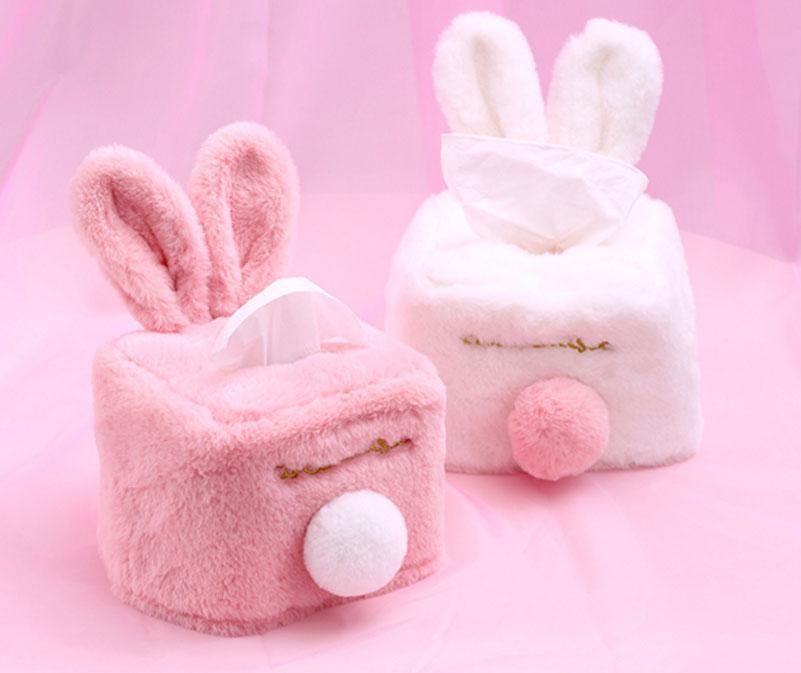
At what (x,y) coordinates should I click in order to perform the action: click on pink surface. Please return your answer as a coordinate pair (x, y). This screenshot has height=673, width=801. Looking at the image, I should click on (637, 566).